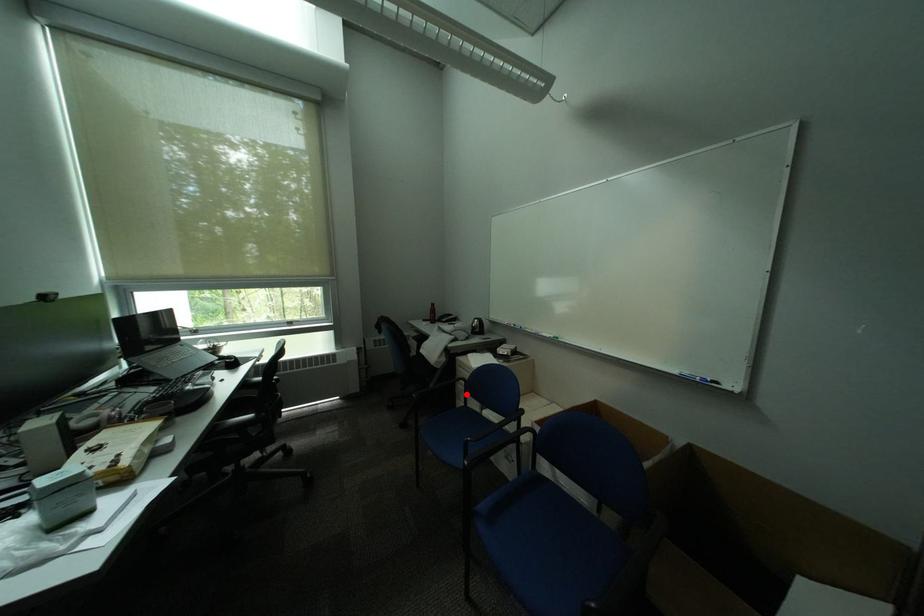
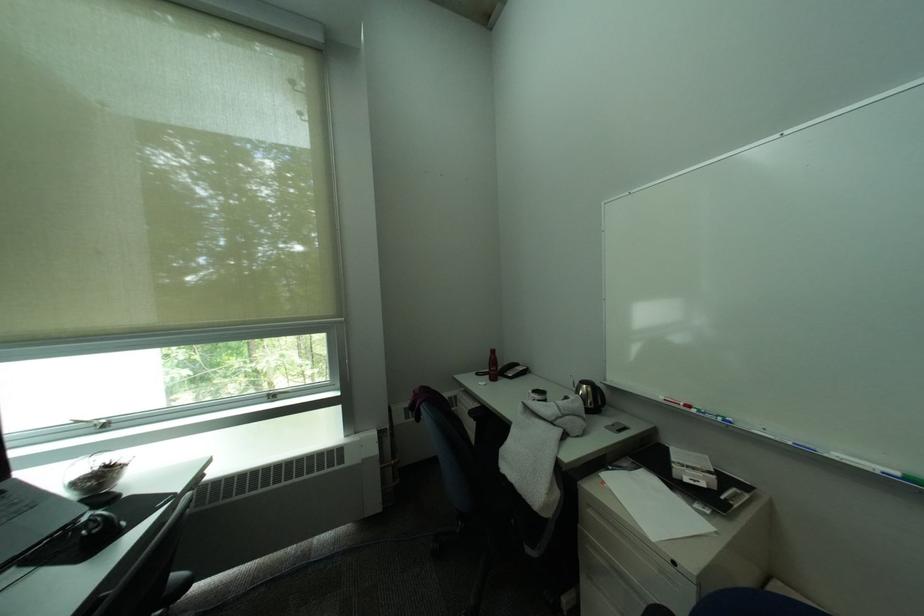
Question: I am providing you with two images of the same scene from different viewpoints. In image1, a red point is highlighted. Considering the same 3D point in image2, which of the following is correct?

Choices:
 (A) It is closer
 (B) It is farther

Answer: (A)